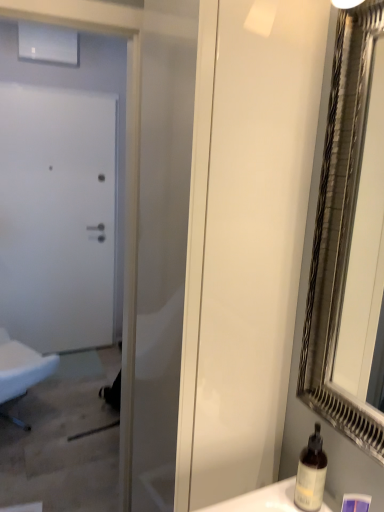
Locate an element on the screen. This screenshot has height=512, width=384. vacant location below white fabric chair at left (from a real-world perspective) is located at coordinates (31, 413).